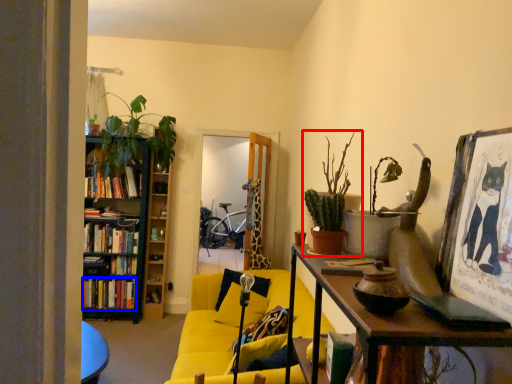
Question: Which of the following is the farthest to the observer, houseplant (highlighted by a red box) or book (highlighted by a blue box)?

Choices:
 (A) houseplant
 (B) book

Answer: (B)